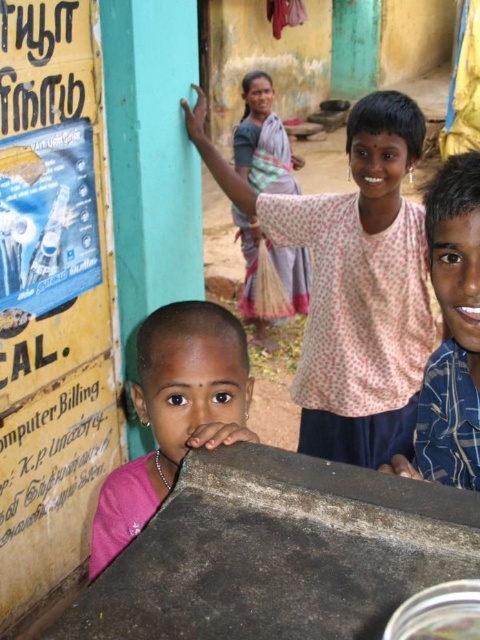
Looking at the image, there are two pink fabrics labeled as pink fabric at upper center and pink fabric at center. Which one is closer to the viewer?

The pink fabric at upper center is closer to the viewer since the pink fabric at center is behind it.